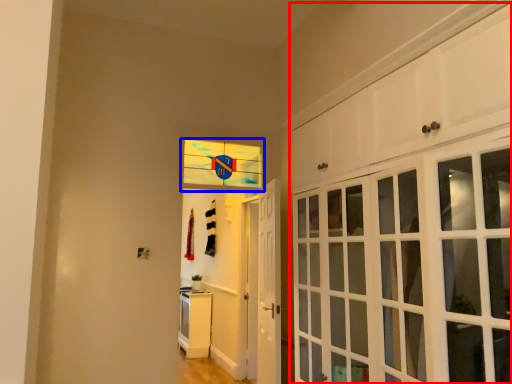
Question: Which object appears closest to the camera in this image, cabinetry (highlighted by a red box) or window (highlighted by a blue box)?

Choices:
 (A) cabinetry
 (B) window

Answer: (A)